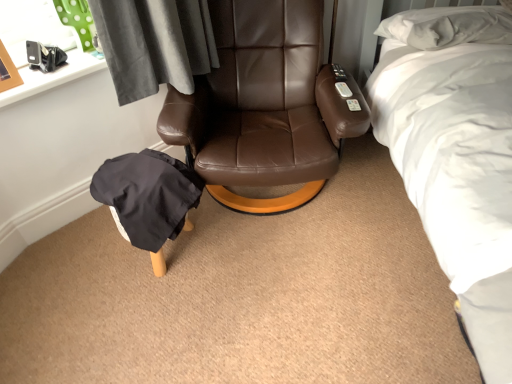
What do you see at coordinates (456, 155) in the screenshot?
I see `white soft bed at upper right` at bounding box center [456, 155].

This screenshot has width=512, height=384. In order to click on black fabric bean bag chair at lower left in this screenshot , I will do `click(148, 198)`.

Locate an element on the screen. brown leather chair at center is located at coordinates (266, 105).

Considering the sizes of objects black fabric bean bag chair at lower left and white soft bed at upper right in the image provided, who is thinner, black fabric bean bag chair at lower left or white soft bed at upper right?

black fabric bean bag chair at lower left is thinner.

From a real-world perspective, which is physically above, black fabric bean bag chair at lower left or white soft bed at upper right?

In real-world perspective, white soft bed at upper right is above.

Measure the distance between black fabric bean bag chair at lower left and white soft bed at upper right.

black fabric bean bag chair at lower left and white soft bed at upper right are 92.25 centimeters apart.

From the image's perspective, is black fabric bean bag chair at lower left positioned above or below white soft bed at upper right?

Clearly, from the image's perspective, black fabric bean bag chair at lower left is below white soft bed at upper right.

Can you confirm if black fabric bean bag chair at lower left is smaller than brown leather chair at center?

Correct, black fabric bean bag chair at lower left occupies less space than brown leather chair at center.

From a real-world perspective, who is located higher, black fabric bean bag chair at lower left or brown leather chair at center?

From a 3D spatial view, brown leather chair at center is above.

Is black fabric bean bag chair at lower left positioned in front of brown leather chair at center?

No, it is not.

Is brown leather chair at center at the back of black fabric bean bag chair at lower left?

black fabric bean bag chair at lower left is not turned away from brown leather chair at center.

Which object is closer to the camera, white soft bed at upper right or brown leather chair at center?

white soft bed at upper right.

Considering the positions of objects white soft bed at upper right and brown leather chair at center in the image provided, who is more to the left, white soft bed at upper right or brown leather chair at center?

brown leather chair at center.

How different are the orientations of white soft bed at upper right and brown leather chair at center in degrees?

There is a 3.33-degree angle between the facing directions of white soft bed at upper right and brown leather chair at center.

Considering the positions of point (214, 136) and point (474, 121), is point (214, 136) closer or farther from the camera than point (474, 121)?

Point (214, 136) is farther from the camera than point (474, 121).

Can you confirm if brown leather chair at center is thinner than white soft bed at upper right?

Yes, brown leather chair at center is thinner than white soft bed at upper right.

Could you tell me if brown leather chair at center is turned towards white soft bed at upper right?

No, brown leather chair at center is not aimed at white soft bed at upper right.

Find the location of a particular element. bed above the black fabric bean bag chair at lower left (from a real-world perspective) is located at coordinates (456, 155).

Does point (389, 64) come closer to viewer compared to point (144, 151)?

No, (389, 64) is further to viewer.

Consider the image. From the image's perspective, between white soft bed at upper right and black fabric bean bag chair at lower left, which one is located above?

white soft bed at upper right, from the image's perspective.

How different are the orientations of white soft bed at upper right and black fabric bean bag chair at lower left in degrees?

The angle between the facing direction of white soft bed at upper right and the facing direction of black fabric bean bag chair at lower left is 1.45 degrees.

The image size is (512, 384). I want to click on bean bag chair on the left of brown leather chair at center, so pos(148,198).

Considering the sizes of brown leather chair at center and black fabric bean bag chair at lower left in the image, is brown leather chair at center bigger or smaller than black fabric bean bag chair at lower left?

Considering their sizes, brown leather chair at center takes up more space than black fabric bean bag chair at lower left.

Considering the relative sizes of brown leather chair at center and black fabric bean bag chair at lower left in the image provided, is brown leather chair at center shorter than black fabric bean bag chair at lower left?

Answer: Incorrect, the height of brown leather chair at center does not fall short of that of black fabric bean bag chair at lower left.

Find the location of `bean bag chair to the left of white soft bed at upper right`. bean bag chair to the left of white soft bed at upper right is located at coordinates (148, 198).

I want to click on bean bag chair below the brown leather chair at center (from the image's perspective), so click(148, 198).

When comparing their distances from white soft bed at upper right, does black fabric bean bag chair at lower left or brown leather chair at center seem further?

Based on the image, black fabric bean bag chair at lower left appears to be further to white soft bed at upper right.

Looking at the image, which one is located closer to brown leather chair at center, white soft bed at upper right or black fabric bean bag chair at lower left?

black fabric bean bag chair at lower left is positioned closer to the anchor brown leather chair at center.

Considering their positions, is white soft bed at upper right positioned further to black fabric bean bag chair at lower left than brown leather chair at center?

white soft bed at upper right.

Estimate the real-world distances between objects in this image. Which object is further from brown leather chair at center, black fabric bean bag chair at lower left or white soft bed at upper right?

white soft bed at upper right.

Looking at the image, which one is located further to black fabric bean bag chair at lower left, brown leather chair at center or white soft bed at upper right?

white soft bed at upper right lies further to black fabric bean bag chair at lower left than the other object.

Which object lies further to the anchor point white soft bed at upper right, brown leather chair at center or black fabric bean bag chair at lower left?

Among the two, black fabric bean bag chair at lower left is located further to white soft bed at upper right.

Find the location of a particular element. Image resolution: width=512 pixels, height=384 pixels. chair between black fabric bean bag chair at lower left and white soft bed at upper right in the horizontal direction is located at coordinates [x=266, y=105].